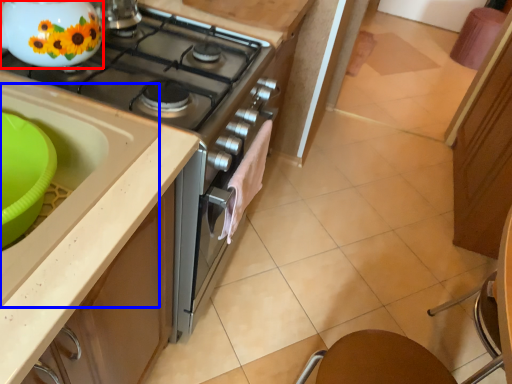
Question: Which point is closer to the camera, kitchen appliance (highlighted by a red box) or sink (highlighted by a blue box)?

Choices:
 (A) kitchen appliance
 (B) sink

Answer: (B)